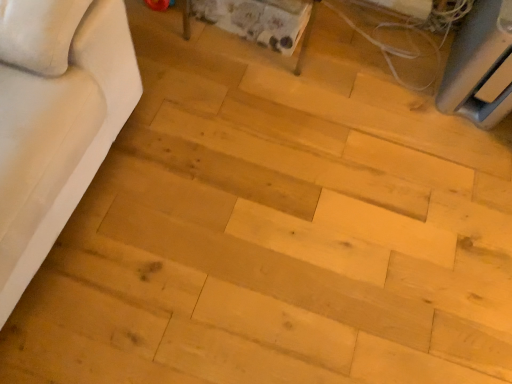
What is the approximate width of matte gray table at upper right?

The width of matte gray table at upper right is 18.00 inches.

What do you see at coordinates (478, 64) in the screenshot?
I see `matte gray table at upper right` at bounding box center [478, 64].

Locate an element on the screen. The image size is (512, 384). matte gray table at upper right is located at coordinates (478, 64).

In order to click on matte gray table at upper right in this screenshot , I will do `click(478, 64)`.